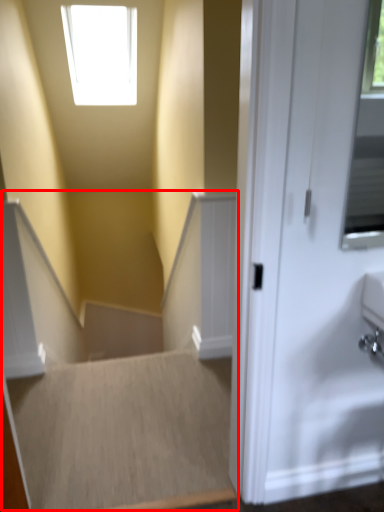
Question: Considering the relative positions of stairwell (annotated by the red box) and stairwell in the image provided, where is stairwell (annotated by the red box) located with respect to the staircase?

Choices:
 (A) left
 (B) right

Answer: (B)